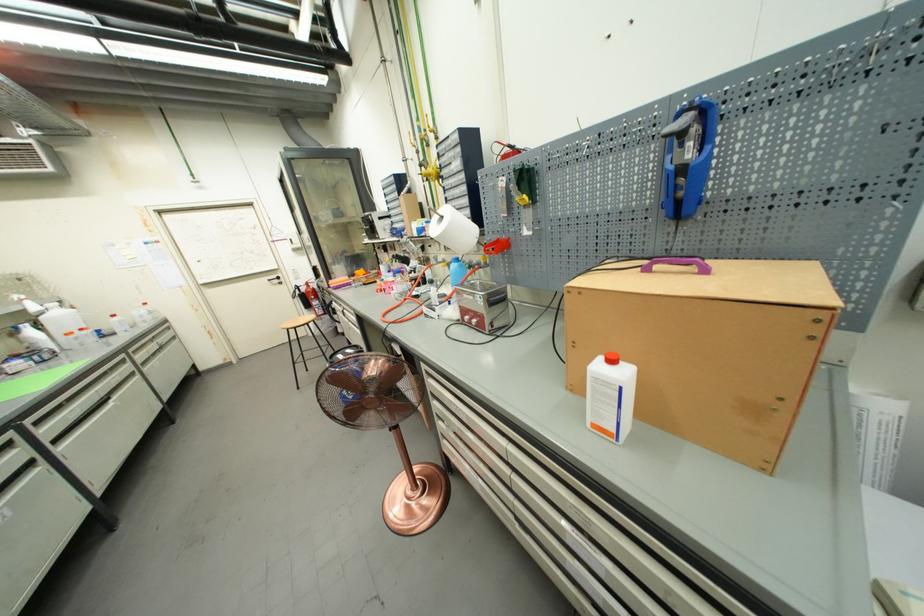
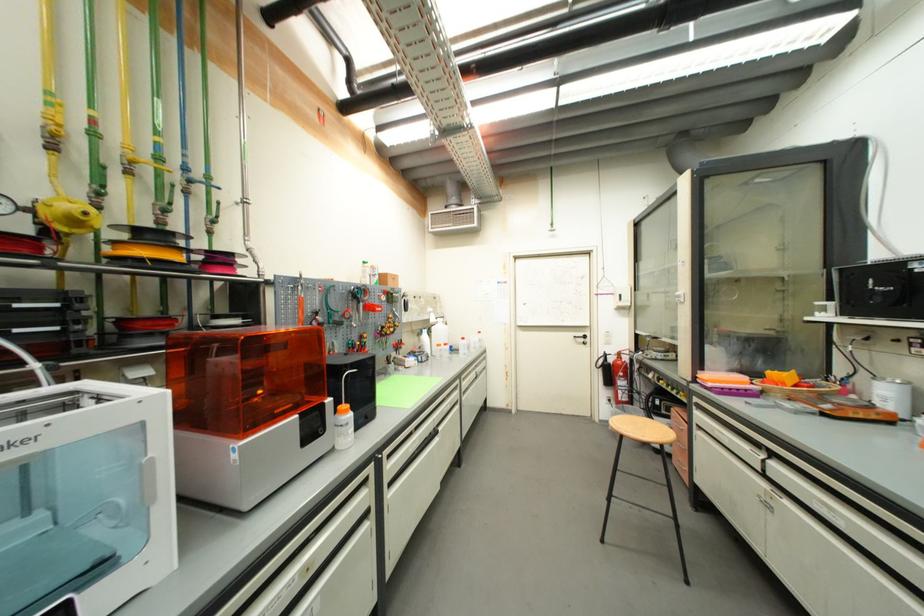
Locate, in the second image, the point that corresponds to point (324, 309) in the first image.

(630, 391)